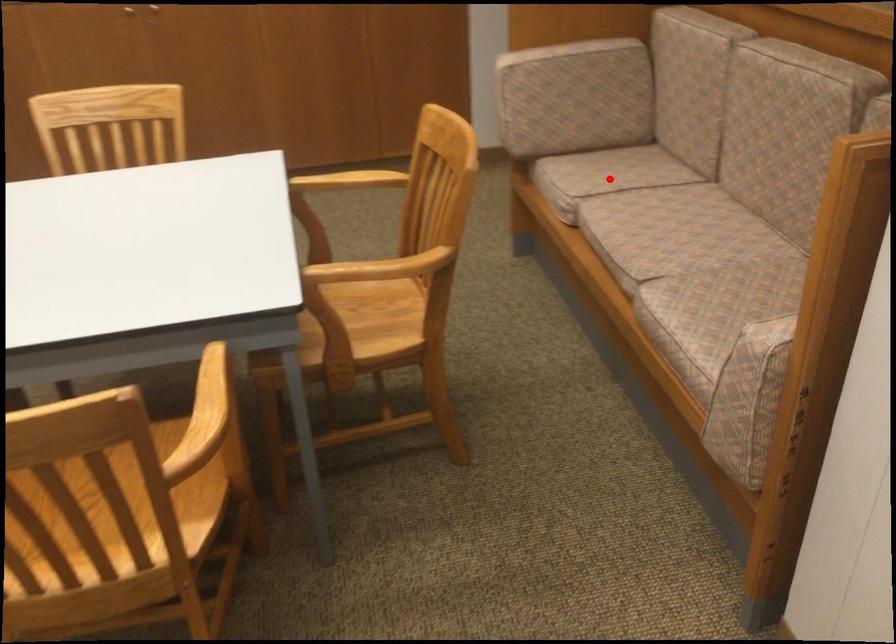
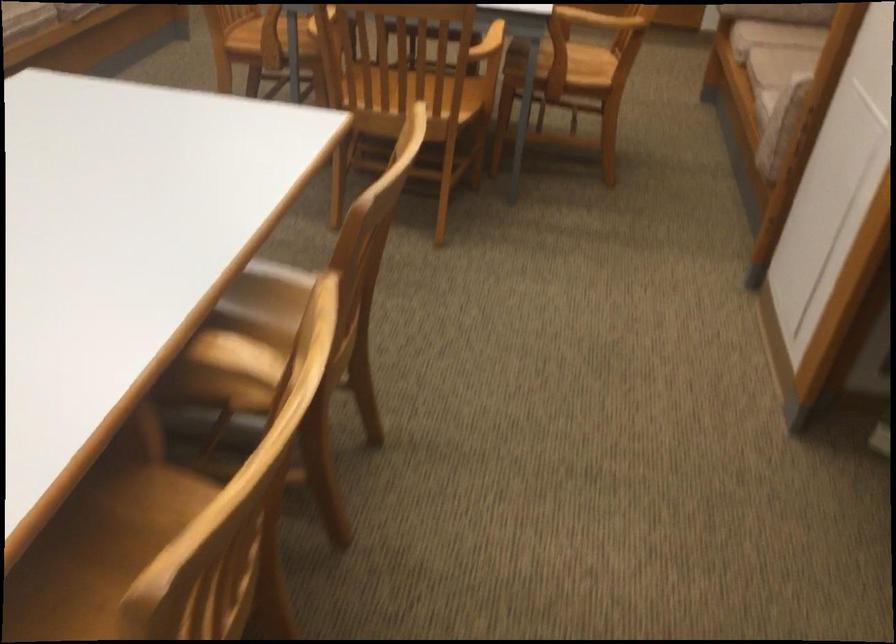
Question: I am providing you with two images of the same scene from different viewpoints. Image1 has a red point marked. In image2, the corresponding 3D location appears at what relative position? Reply with the corresponding letter.

Choices:
 (A) Closer
 (B) Farther

Answer: (B)